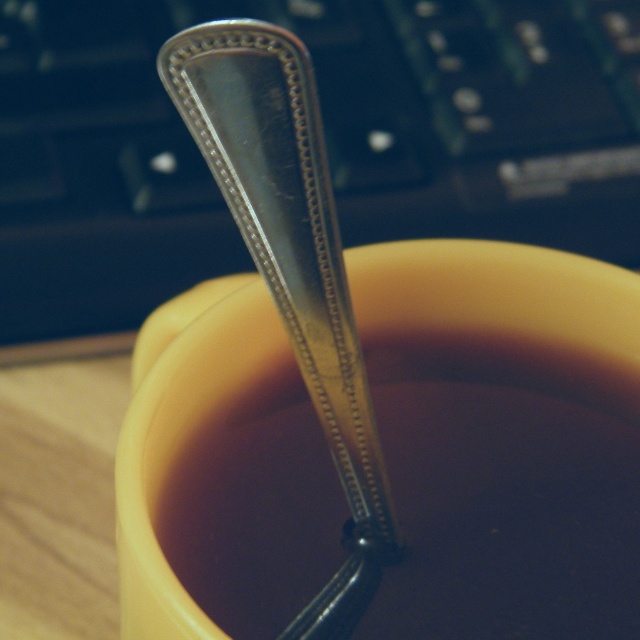
You are an assistant who needs to place a decorative spoon in the image. The spoon must be placed exactly at the center of the wooden surface. Is the shiny metallic spoon at center currently positioned correctly?

The shiny metallic spoon at center is located at point coordinates of (506, 497). Since the center of the wooden surface would be at point coordinates of (320, 320), the spoon is not positioned correctly.

You are organizing a small table and have to place the black plastic keyboard at upper center and the polished silver spoon at center. If the table has a width of 40 cm, can both items fit side by side without overlapping?

The black plastic keyboard at upper center might be wider than the polished silver spoon at center, so it is uncertain if both can fit side by side on a 40 cm wide table. Measure their combined width to confirm.